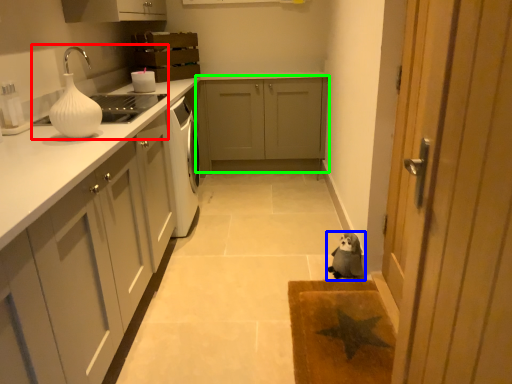
Question: Considering the real-world distances, which object is farthest from sink (highlighted by a red box)? dog (highlighted by a blue box) or cabinetry (highlighted by a green box)?

Choices:
 (A) dog
 (B) cabinetry

Answer: (A)